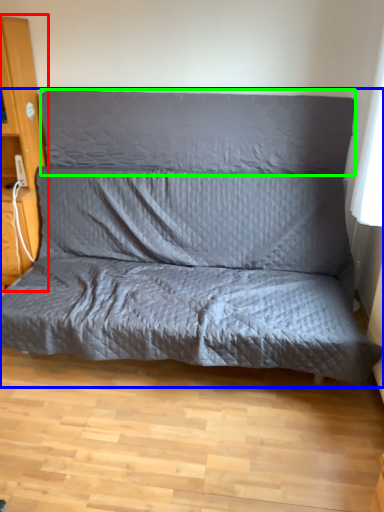
Question: Which is farther away from dresser (highlighted by a red box)? studio couch (highlighted by a blue box) or pillow (highlighted by a green box)?

Choices:
 (A) studio couch
 (B) pillow

Answer: (A)